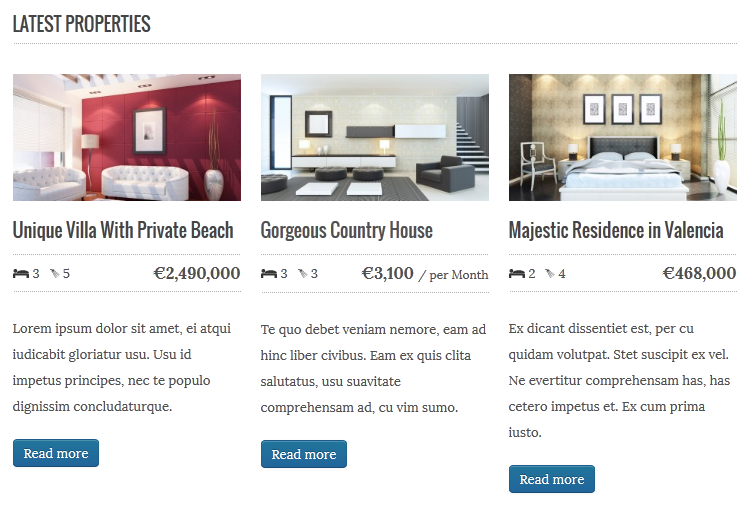
At what (x,y) coordinates should I click in order to perform the action: click on window. Please return your answer as a coordinate pair (x, y). Looking at the image, I should click on (282, 119), (26, 129).